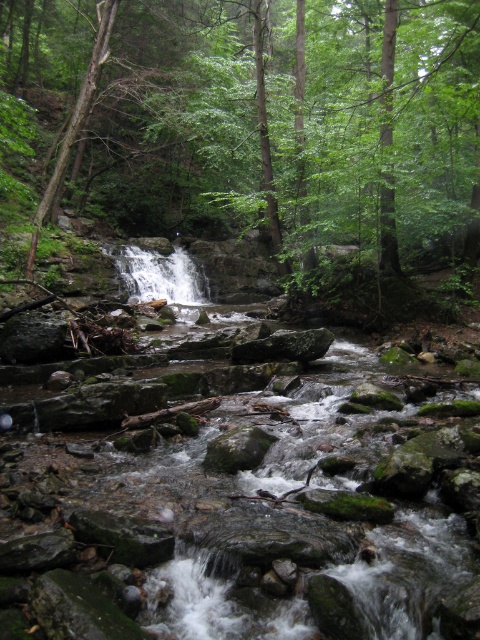
Question: Which point is farther from the camera taking this photo?

Choices:
 (A) [x=145, y=284]
 (B) [x=431, y=211]

Answer: (A)

Question: Can you confirm if green leafy tree at center is positioned above white textured water at center?

Choices:
 (A) yes
 (B) no

Answer: (A)

Question: Where is green leafy tree at center located in relation to white textured water at center in the image?

Choices:
 (A) below
 (B) above

Answer: (B)

Question: Which object appears closest to the camera in this image?

Choices:
 (A) white textured water at center
 (B) green leafy tree at center

Answer: (B)

Question: Observing the image, what is the correct spatial positioning of green leafy tree at center in reference to white textured water at center?

Choices:
 (A) above
 (B) below

Answer: (A)